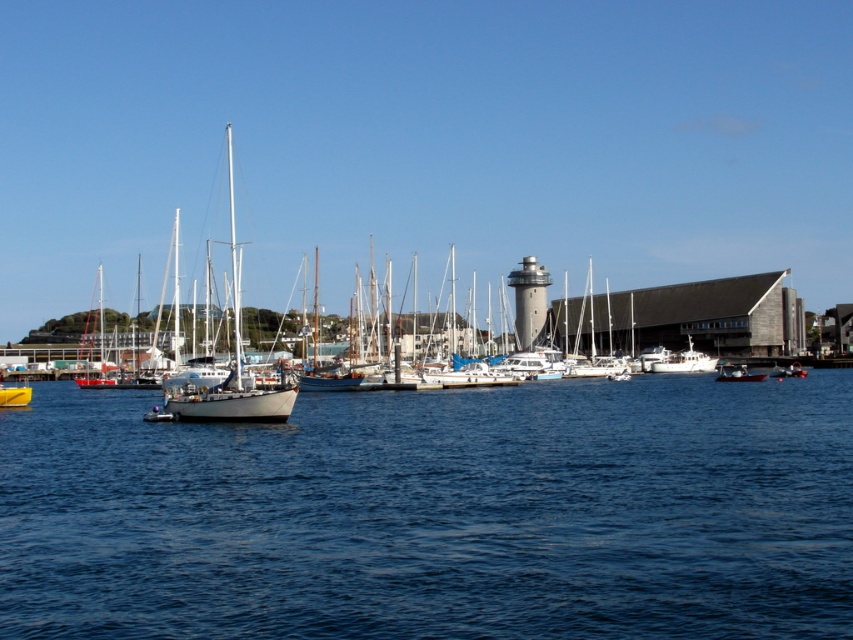
Based on the photo, which is more to the left, metallic silver boat at center or yellow matte boat at center?

yellow matte boat at center

How much distance is there between metallic silver boat at center and yellow matte boat at center?

metallic silver boat at center is 53.00 meters away from yellow matte boat at center.

I want to click on metallic silver boat at center, so click(737, 372).

Can you confirm if blue water at center is positioned to the left of yellow matte boat at center?

Incorrect, blue water at center is not on the left side of yellow matte boat at center.

Is point (614, 442) closer to viewer compared to point (12, 404)?

Yes.

Who is more forward, (496, 596) or (1, 406)?

Positioned in front is point (496, 596).

This screenshot has width=853, height=640. Identify the location of blue water at center. (436, 513).

Who is positioned more to the left, blue water at center or metallic silver boat at center?

blue water at center

Does blue water at center have a lesser height compared to metallic silver boat at center?

No.

Measure the distance between point (120,604) and camera.

A distance of 40.59 feet exists between point (120,604) and camera.

The width and height of the screenshot is (853, 640). In order to click on blue water at center in this screenshot , I will do `click(436, 513)`.